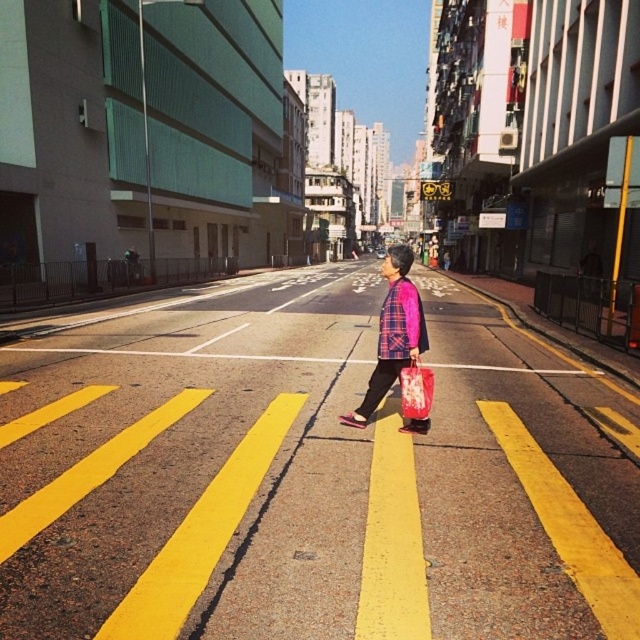
Question: Which point is farther from the camera taking this photo?

Choices:
 (A) (404, 358)
 (B) (406, 406)

Answer: (A)

Question: Which object appears closest to the camera in this image?

Choices:
 (A) matte pink shopping bag at center
 (B) plaid fabric shirt at center

Answer: (A)

Question: Observing the image, what is the correct spatial positioning of plaid fabric shirt at center in reference to matte pink shopping bag at center?

Choices:
 (A) left
 (B) right

Answer: (B)

Question: In this image, where is plaid fabric shirt at center located relative to matte pink shopping bag at center?

Choices:
 (A) left
 (B) right

Answer: (B)

Question: Can you confirm if plaid fabric shirt at center is positioned to the right of matte pink shopping bag at center?

Choices:
 (A) yes
 (B) no

Answer: (A)